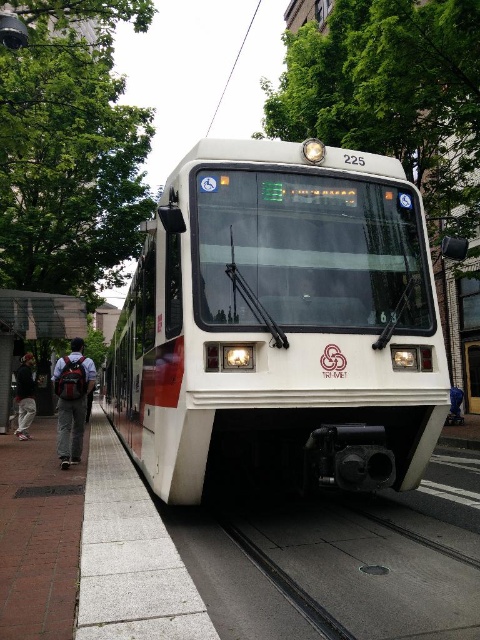
You are standing in front of the white glossy train at center and the matte red backpack at left. Which object takes up more space visually?

The matte red backpack at left takes up more space visually than the white glossy train at center because the white glossy train at center occupies less space according to the description.

You are a passenger on the light rail vehicle 225 and want to place your dark gray backpack at left on the floor. Is there enough space under it for the black rubber train track at center?

The black rubber train track at center is positioned under dark gray backpack at left, so placing the dark gray backpack at left there would cover the black rubber train track at center. There is not enough space as the backpack would block the track.